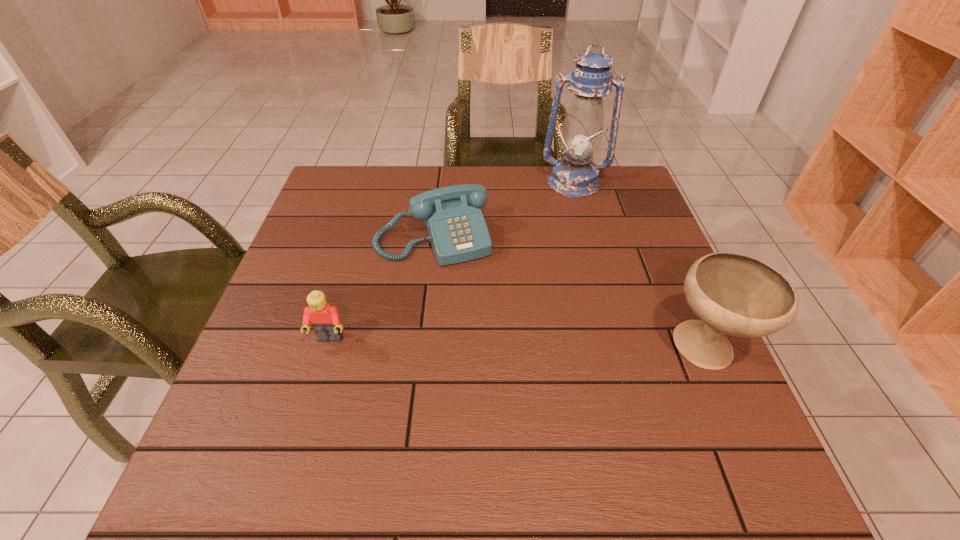
You are a GUI agent. You are given a task and a screenshot of the screen. Output one action in this format:
    pyautogui.click(x=<x>, y=<y>)
    Task: Click on the free space located 0.390m on the front-facing side of the farthest object
    
    Given the screenshot: What is the action you would take?
    pyautogui.click(x=569, y=298)

Identify the location of free spot located 0.300m on the front-facing side of the farthest object. The image size is (960, 540). (570, 271).

Where is `free region located on the front-facing side of the farthest object`? Image resolution: width=960 pixels, height=540 pixels. free region located on the front-facing side of the farthest object is located at coordinates (570, 256).

The image size is (960, 540). I want to click on telephone that is positioned at the far edge, so click(457, 231).

The height and width of the screenshot is (540, 960). In order to click on lantern at the far edge in this screenshot , I will do `click(575, 175)`.

Where is `object present at the left edge`? This screenshot has height=540, width=960. object present at the left edge is located at coordinates (325, 320).

Locate an element on the screen. The height and width of the screenshot is (540, 960). chalice at the right edge is located at coordinates (735, 294).

In order to click on lantern at the right edge in this screenshot , I will do `click(575, 175)`.

At what (x,y) coordinates should I click in order to perform the action: click on object at the far right corner. Please return your answer as a coordinate pair (x, y). Looking at the image, I should click on (575, 175).

You are a GUI agent. You are given a task and a screenshot of the screen. Output one action in this format:
    pyautogui.click(x=<x>, y=<y>)
    Task: Click on the vacant space at the far edge of the desktop
    The width and height of the screenshot is (960, 540).
    Given the screenshot: What is the action you would take?
    pyautogui.click(x=543, y=177)